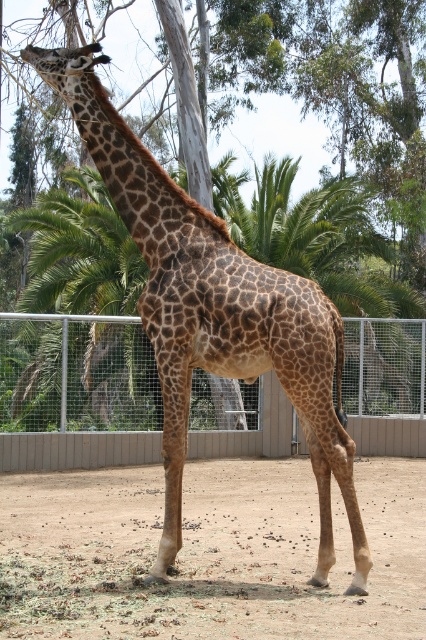
Is brown spotted giraffe at center below metal wire fence at center?

Actually, brown spotted giraffe at center is above metal wire fence at center.

Is brown spotted giraffe at center wider than metal wire fence at center?

Incorrect, brown spotted giraffe at center's width does not surpass metal wire fence at center's.

Locate an element on the screen. brown spotted giraffe at center is located at coordinates (213, 310).

Where is `brown spotted giraffe at center`? The width and height of the screenshot is (426, 640). brown spotted giraffe at center is located at coordinates (213, 310).

Does point (5, 598) lie behind point (23, 321)?

No, it is not.

Which is below, brown sandy dirt at center or metal wire fence at center?

brown sandy dirt at center is lower down.

Image resolution: width=426 pixels, height=640 pixels. Find the location of `brown sandy dirt at center`. brown sandy dirt at center is located at coordinates (209, 552).

Can you confirm if brown sandy dirt at center is positioned to the left of brown spotted giraffe at center?

Incorrect, brown sandy dirt at center is not on the left side of brown spotted giraffe at center.

Does brown sandy dirt at center have a lesser height compared to brown spotted giraffe at center?

Indeed, brown sandy dirt at center has a lesser height compared to brown spotted giraffe at center.

Which is in front, point (264, 483) or point (89, 124)?

Point (89, 124)

You are a GUI agent. You are given a task and a screenshot of the screen. Output one action in this format:
    pyautogui.click(x=<x>, y=<y>)
    Task: Click on the brown sandy dirt at center
    
    Given the screenshot: What is the action you would take?
    pyautogui.click(x=209, y=552)